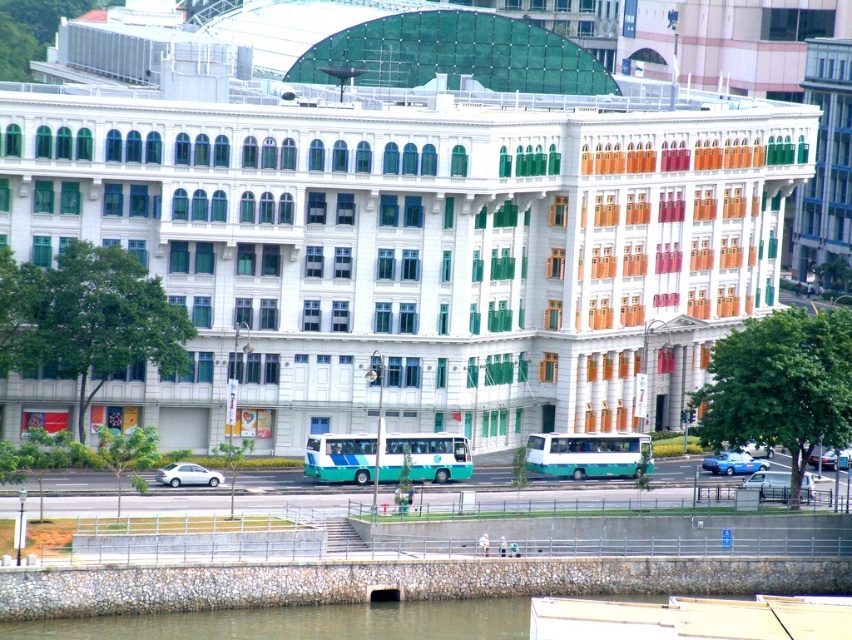
Can you confirm if teal glossy bus at center is positioned to the left of teal/green metallic bus at center?

Yes, teal glossy bus at center is to the left of teal/green metallic bus at center.

Can you confirm if teal glossy bus at center is positioned above teal/green metallic bus at center?

Yes.

Is point (461, 477) less distant than point (648, 464)?

Yes, point (461, 477) is closer to viewer.

Identify the location of teal glossy bus at center. The height and width of the screenshot is (640, 852). (426, 456).

Between blue metallic car at lower right and metallic silver car at center, which one appears on the right side from the viewer's perspective?

metallic silver car at center

Can you confirm if blue metallic car at lower right is bigger than metallic silver car at center?

Actually, blue metallic car at lower right might be smaller than metallic silver car at center.

Find the location of `blue metallic car at lower right`. blue metallic car at lower right is located at coordinates (734, 461).

Does teal glossy bus at center appear on the right side of white matte van at lower right?

Incorrect, teal glossy bus at center is not on the right side of white matte van at lower right.

Is teal glossy bus at center in front of white matte van at lower right?

No, teal glossy bus at center is behind white matte van at lower right.

What do you see at coordinates (426, 456) in the screenshot?
I see `teal glossy bus at center` at bounding box center [426, 456].

Identify the location of teal glossy bus at center. (426, 456).